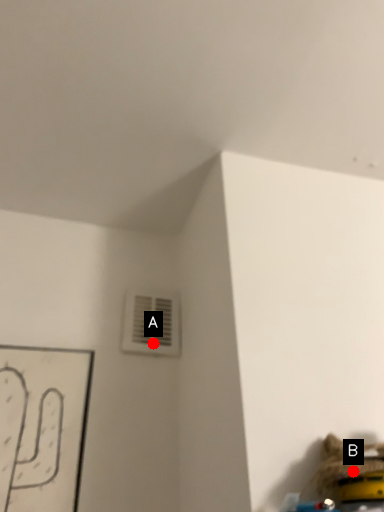
Question: Two points are circled on the image, labeled by A and B beside each circle. Which of the following is the farthest from the observer?

Choices:
 (A) A is further
 (B) B is further

Answer: (A)